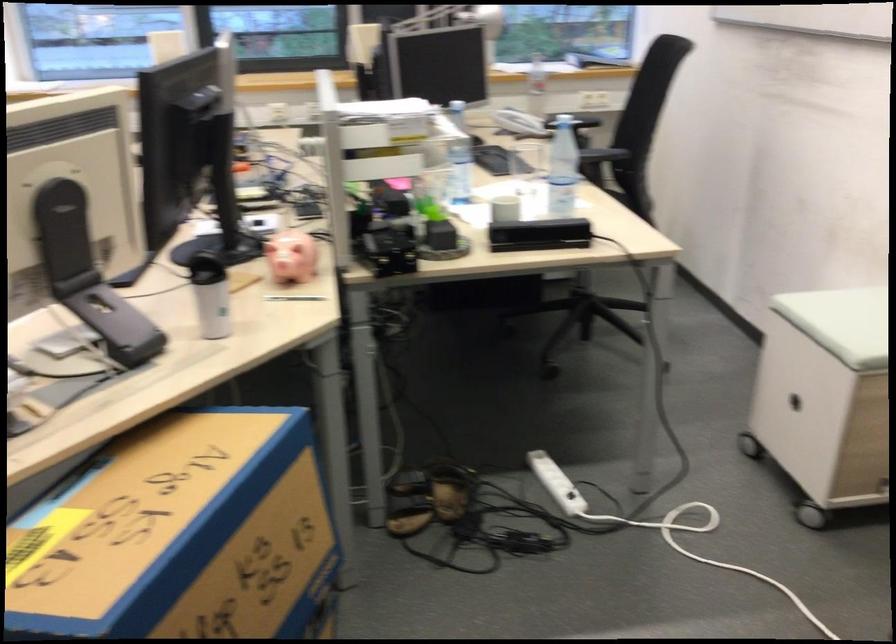
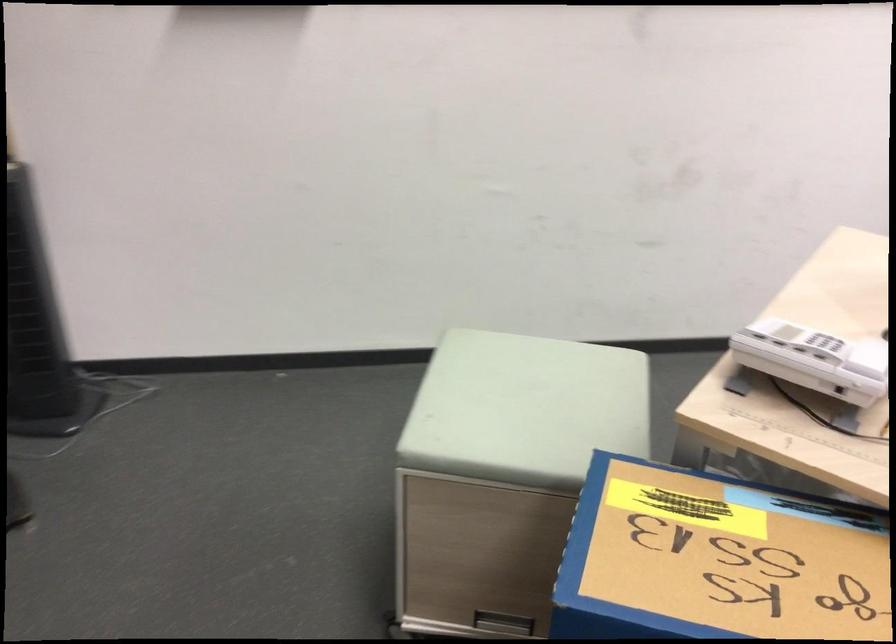
The first image is from the beginning of the video and the second image is from the end. How did the camera likely rotate when shooting the video?

The camera's rotation is toward left-down.